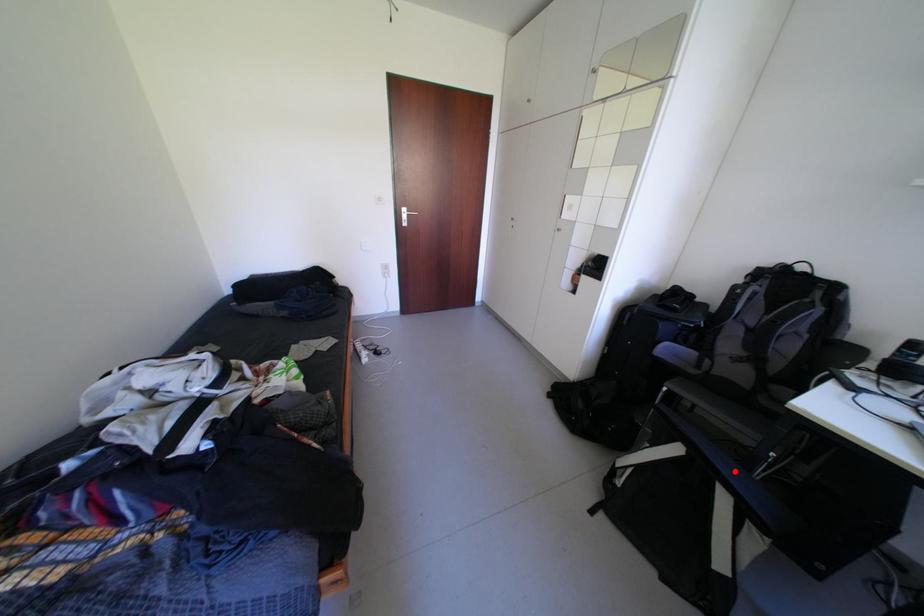
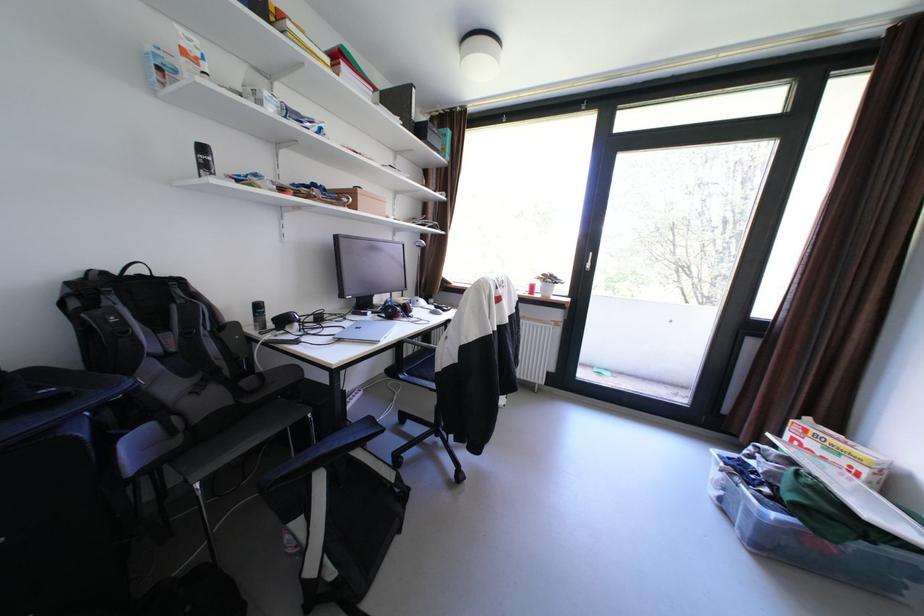
Where in the second image is the point corresponding to the highlighted location from the first image?

(361, 440)